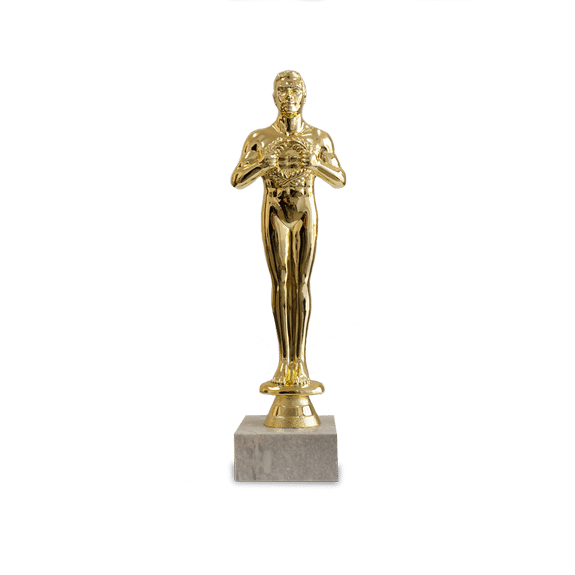
You are a GUI agent. You are given a task and a screenshot of the screen. Output one action in this format:
    pyautogui.click(x=<x>, y=<y>)
    Task: Click on the golden statuette
    
    Given the screenshot: What is the action you would take?
    pyautogui.click(x=289, y=140)